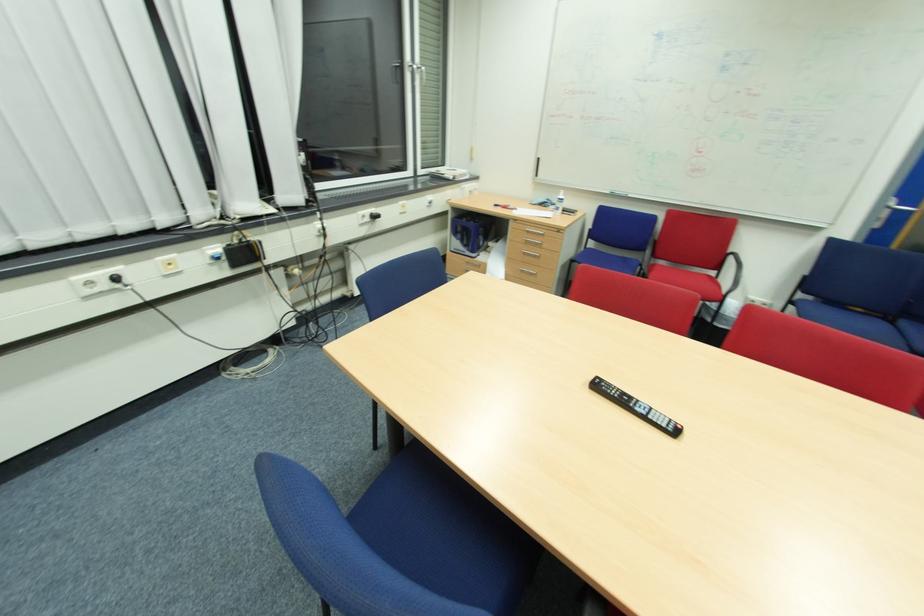
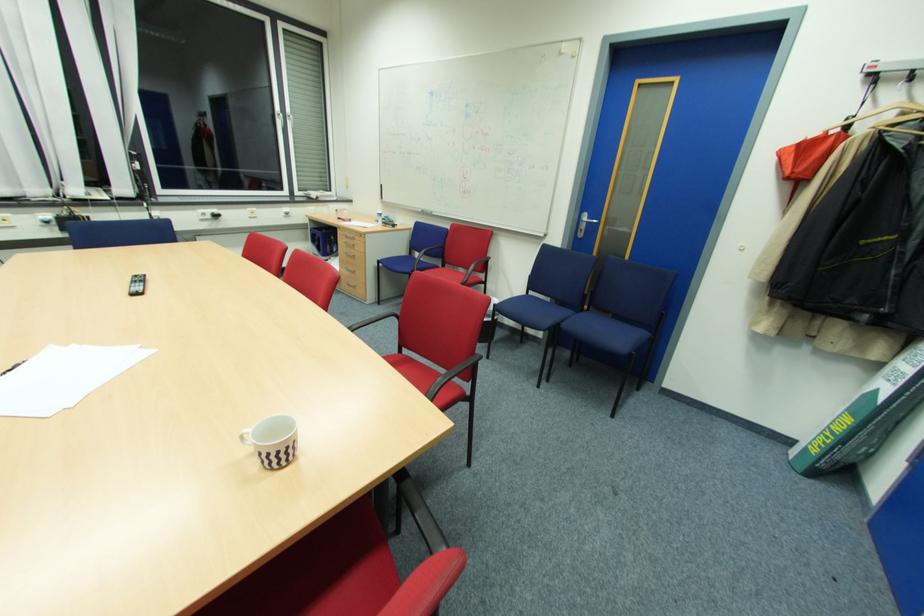
Locate, in the second image, the point that corresponds to point 521,222 in the first image.

(344, 229)